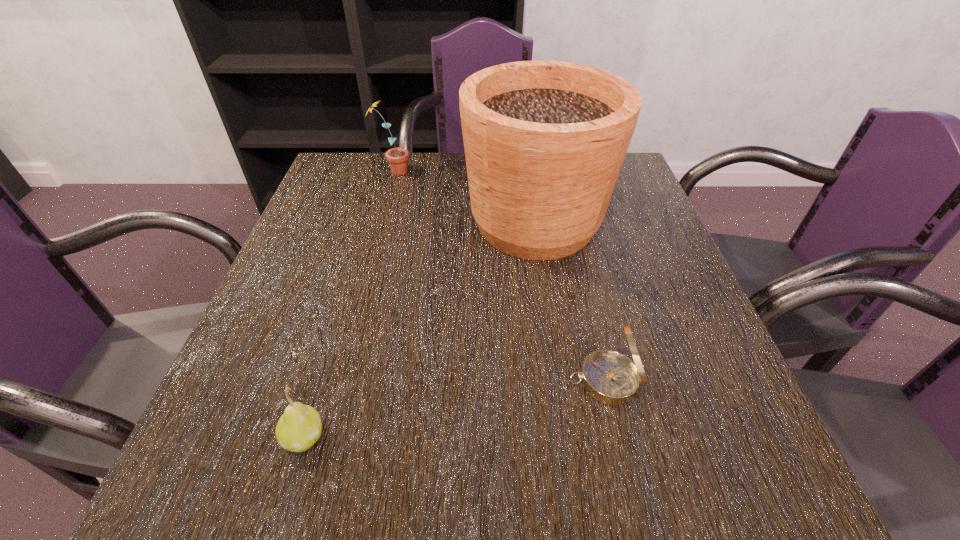
Image resolution: width=960 pixels, height=540 pixels. In order to click on free space between the nearest object and the second farthest object in this screenshot , I will do `click(420, 329)`.

This screenshot has height=540, width=960. In order to click on vacant space that's between the pear and the second nearest object in this screenshot , I will do `click(455, 409)`.

Where is `unoccupied position between the tallest object and the nearest object`? The height and width of the screenshot is (540, 960). unoccupied position between the tallest object and the nearest object is located at coordinates (420, 329).

This screenshot has height=540, width=960. Find the location of `vacant area between the second tallest object and the tallest object`. vacant area between the second tallest object and the tallest object is located at coordinates pos(465,197).

This screenshot has height=540, width=960. Find the location of `free space that is in between the nearest object and the flowerpot`. free space that is in between the nearest object and the flowerpot is located at coordinates (420, 329).

Find the location of `vacant region between the pear and the compass`. vacant region between the pear and the compass is located at coordinates (455, 409).

Identify the location of free space between the third farthest object and the nearest object. (455, 409).

You are a GUI agent. You are given a task and a screenshot of the screen. Output one action in this format:
    pyautogui.click(x=<x>, y=<y>)
    Task: Click on the free spot between the nearest object and the second nearest object
    The height and width of the screenshot is (540, 960).
    Given the screenshot: What is the action you would take?
    [455, 409]

Locate an element on the screen. object that is the second closest to the second tallest object is located at coordinates (610, 377).

Identify the location of object identified as the third closest to the farthest object. Image resolution: width=960 pixels, height=540 pixels. (299, 428).